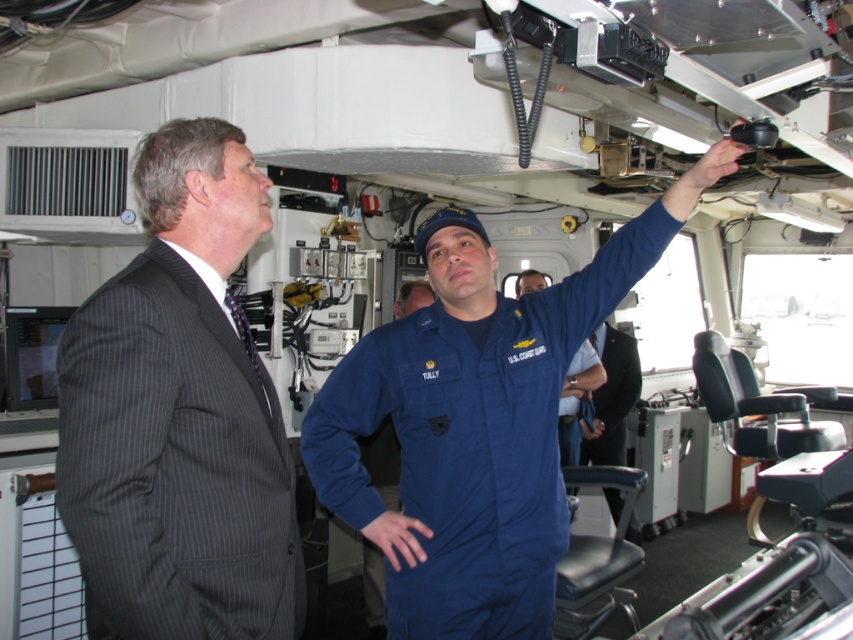
You are a photographer positioned at the back of the room. You want to take a photo of both the dark gray pinstripe suit at left and the blue uniform at center. Which person should you focus on first to ensure both are in focus?

You should focus on the dark gray pinstripe suit at left first since it is closer to you than the blue uniform at center, ensuring both will be in focus when you adjust the camera accordingly.

You are a photographer trying to capture a group photo of the dark gray pinstripe suit at left and the blue uniform at center. Based on their heights, which person should stand in the front row to ensure both are visible in the photo?

The dark gray pinstripe suit at left has a lesser height compared to blue uniform at center, so the dark gray pinstripe suit at left should stand in the front row to ensure both are visible in the photo.

You are a guest on a naval vessel and see the dark gray pinstripe suit at left and the blue uniform at center. Which person is standing to the right of the other?

The blue uniform at center is standing to the right of the dark gray pinstripe suit at left.